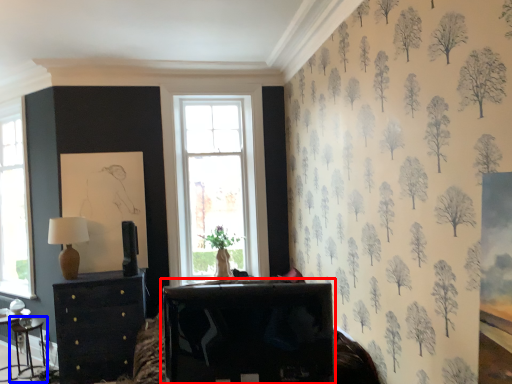
Question: Which point is closer to the camera, table (highlighted by a red box) or table (highlighted by a blue box)?

Choices:
 (A) table
 (B) table

Answer: (A)